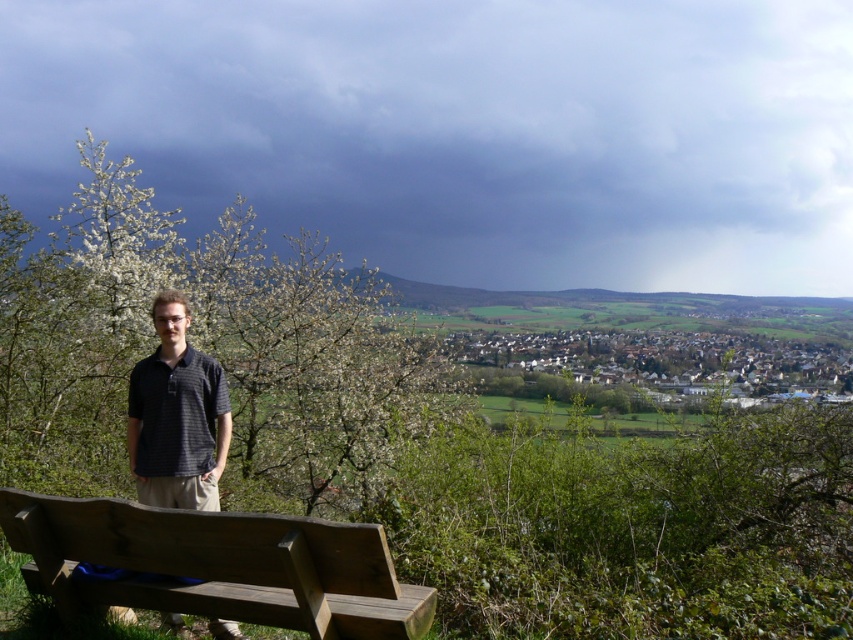
Question: Which point appears farthest from the camera in this image?

Choices:
 (A) (x=140, y=227)
 (B) (x=428, y=605)

Answer: (A)

Question: Does wooden bench at lower left have a smaller size compared to dark blue striped polo shirt at center?

Choices:
 (A) yes
 (B) no

Answer: (B)

Question: Does wooden bench at lower left lie behind dark blue striped polo shirt at center?

Choices:
 (A) no
 (B) yes

Answer: (A)

Question: Can you confirm if wooden bench at lower left is bigger than dark blue striped polo shirt at center?

Choices:
 (A) yes
 (B) no

Answer: (A)

Question: Estimate the real-world distances between objects in this image. Which object is closer to the dark blue striped polo shirt at center?

Choices:
 (A) green leafy tree at left
 (B) wooden bench at lower left

Answer: (B)

Question: Which point is closer to the camera?

Choices:
 (A) (175, 260)
 (B) (213, 444)

Answer: (B)